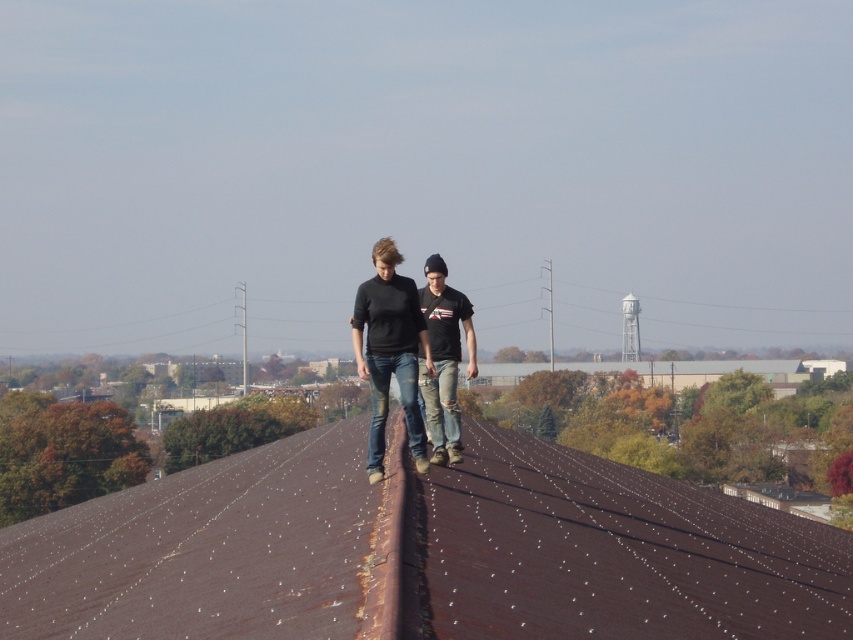
Based on the photo, you are a construction worker assessing the safety of the roof. The brown rusted metal roof at center and denim jeans at center are both in your line of sight. Which object is bigger in size?

The brown rusted metal roof at center is larger in size compared to the denim jeans at center.

You are standing at a safe distance and see the point marked at coordinates [469,429] in the image. If you want to throw a small object to that point, which is 33.01 meters away from you, would you need to aim higher or lower than the point to hit it?

Since the point is 33.01 meters away from you, you would need to aim higher than the point to account for the trajectory of the throw. This is because gravity will pull the object downward during its flight, requiring an elevated angle to reach the target.